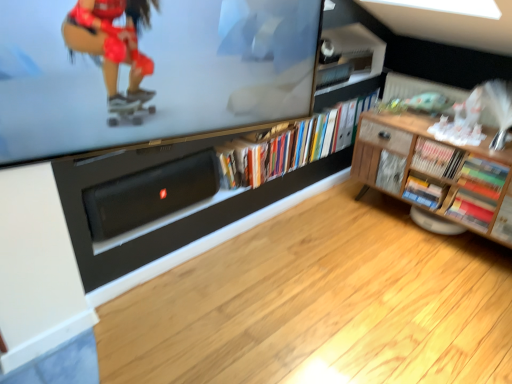
Question: From a real-world perspective, is hardcover book at center-right, the fourth book when ordered from right to left, positioned above or below multicolored paper book at lower right, acting as the second book starting from the right?

Choices:
 (A) above
 (B) below

Answer: (A)

Question: Looking at their shapes, would you say hardcover book at center-right, which is counted as the second book, starting from the left, is wider or thinner than multicolored paper book at lower right, acting as the second book starting from the right?

Choices:
 (A) wide
 (B) thin

Answer: (B)

Question: Which object is the farthest from the hardcover books at center, the fifth book positioned from the right?

Choices:
 (A) multicolored cardboard book at right, the first book when ordered from right to left
 (B) black matte speaker at lower center
 (C) wooden bookshelf at right, which appears as the third book when viewed from the right
 (D) wooden cabinet at right
 (E) hardcover book at center-right, which is counted as the second book, starting from the left

Answer: (A)

Question: Which of these objects is positioned closest to the multicolored cardboard book at right, the fifth book in the left-to-right sequence?

Choices:
 (A) black matte speaker at lower center
 (B) hardcover books at center, which ranks as the 1th book in left-to-right order
 (C) matte black television at upper center
 (D) multicolored paper book at lower right, which is counted as the fourth book, starting from the left
 (E) wooden cabinet at right

Answer: (D)